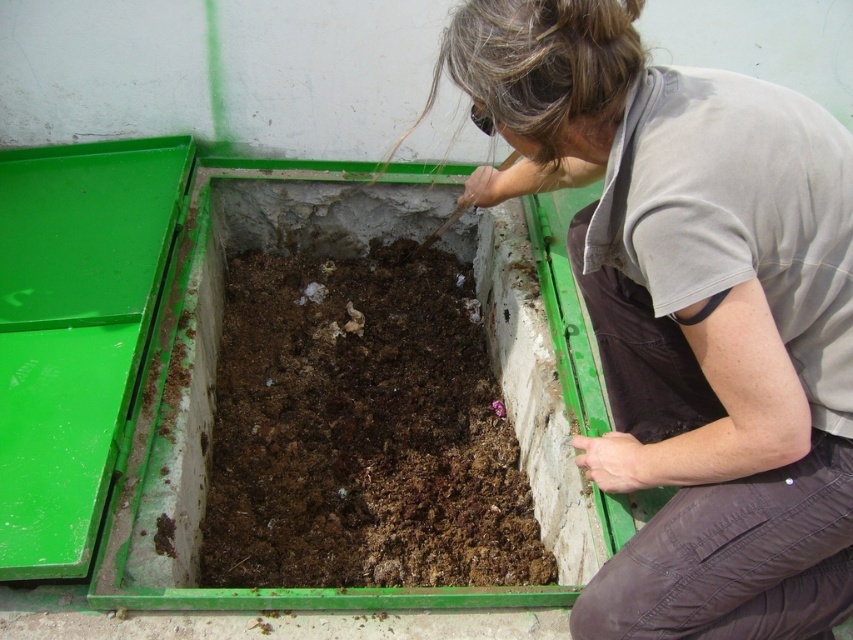
Is gray fabric shirt at center below brown soil at center?

No, gray fabric shirt at center is not below brown soil at center.

Is point (662, 138) behind point (305, 566)?

No, it is in front of (305, 566).

This screenshot has height=640, width=853. I want to click on gray fabric shirt at center, so click(x=685, y=310).